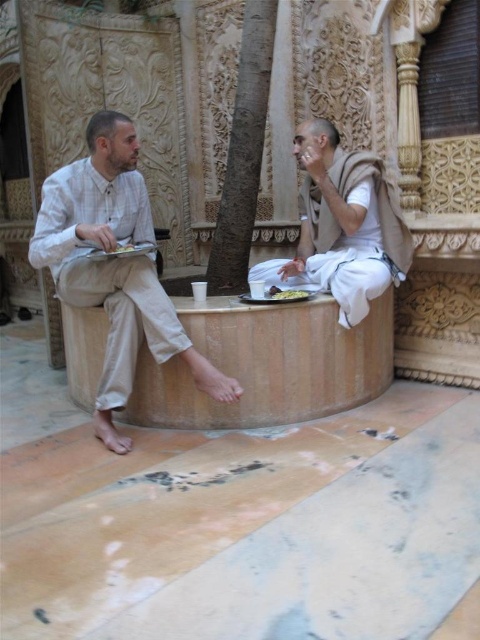
Question: Among these objects, which one is nearest to the camera?

Choices:
 (A) brown textured tree at center
 (B) white matte cup at center
 (C) white cotton cloth at center
 (D) light beige cotton pants at left

Answer: (D)

Question: Is white cotton cloth at center positioned at the back of brown textured tree at center?

Choices:
 (A) yes
 (B) no

Answer: (B)

Question: Which of the following is the farthest from the observer?

Choices:
 (A) (261, 8)
 (B) (74, 252)

Answer: (A)

Question: Is light beige cotton pants at left below white cotton cloth at center?

Choices:
 (A) yes
 (B) no

Answer: (A)

Question: Which point is closer to the camera?

Choices:
 (A) (300, 264)
 (B) (113, 344)
 (C) (280, 291)

Answer: (B)

Question: Does white cotton cloth at center come in front of white matte cup at center?

Choices:
 (A) yes
 (B) no

Answer: (B)